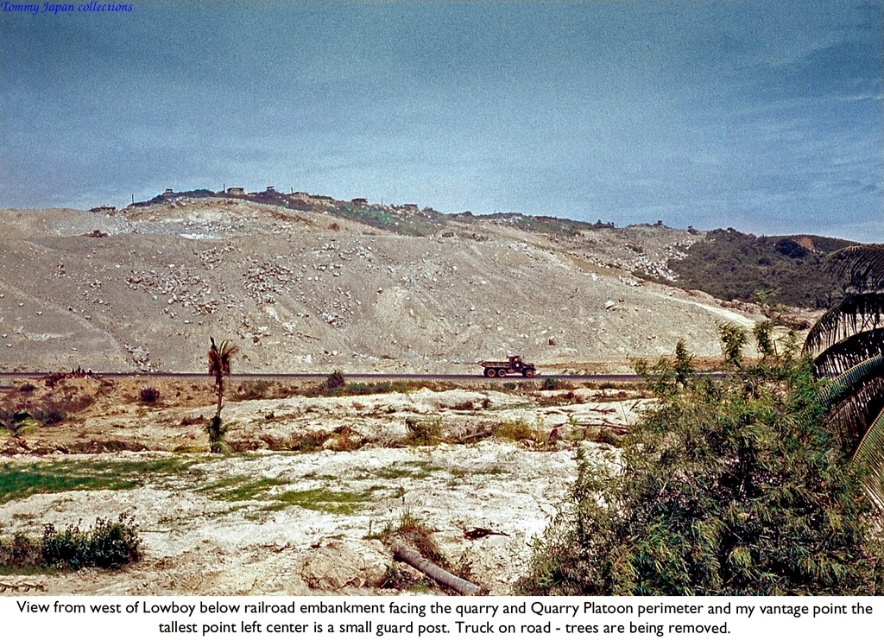
You are a surveyor assessing terrain for construction. You need to determine if the dull gray rock at center can be safely passed over by heavy machinery without causing damage to the brown dirt road at center. Based on the scene description, what should you advise?

The dull gray rock at center is much taller than the brown dirt road at center. Heavy machinery attempting to pass over it may cause damage to the road due to the rock being elevated higher than the road surface.

You are a construction worker needing to place a 3m wide equipment between the dull gray rock at center and the brown dirt road at center. Can you fit it there?

The dull gray rock at center might be wider than brown dirt road at center, so the space between them may not be sufficient to fit a 3m wide equipment. Check the actual width before placing it.